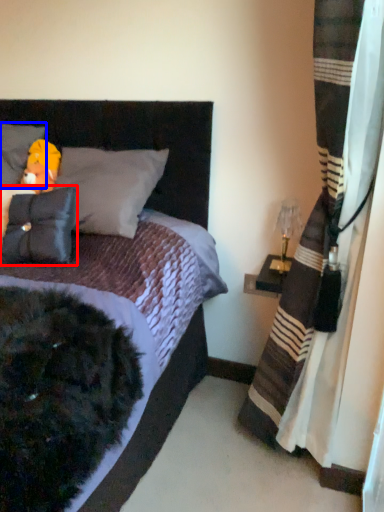
Question: Which of the following is the farthest to the observer, pillow (highlighted by a red box) or pillow (highlighted by a blue box)?

Choices:
 (A) pillow
 (B) pillow

Answer: (B)